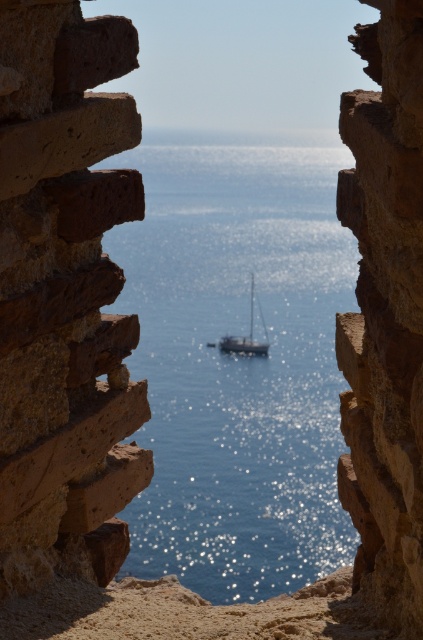
Question: Which object is the closest to the brown rough stone at center?

Choices:
 (A) blue glossy water at center
 (B) brown rough cliff at center
 (C) white glossy sailboat at center

Answer: (B)

Question: Among these points, which one is farthest from the camera?

Choices:
 (A) (63, 172)
 (B) (420, 68)
 (C) (224, 337)

Answer: (C)

Question: Does brown rough stone at center have a smaller size compared to brown rough cliff at center?

Choices:
 (A) yes
 (B) no

Answer: (A)

Question: Is blue glossy water at center to the left of white glossy sailboat at center from the viewer's perspective?

Choices:
 (A) no
 (B) yes

Answer: (B)

Question: Does brown rough cliff at center have a smaller size compared to white glossy sailboat at center?

Choices:
 (A) yes
 (B) no

Answer: (A)

Question: Among these objects, which one is nearest to the camera?

Choices:
 (A) brown rough stone at center
 (B) brown rough cliff at center
 (C) blue glossy water at center

Answer: (B)